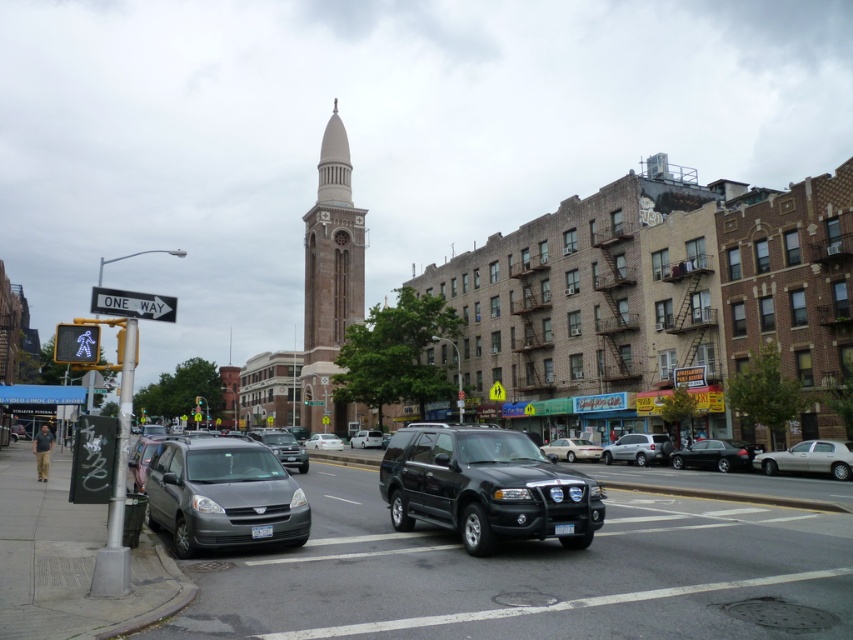
You are a delivery driver navigating through the intersection. Your GPS indicates you need to turn left at the next intersection, but there is a black matte suv at center blocking your path. Based on its position, can you estimate if there is enough space to maneuver around it?

The black matte suv at center is positioned at coordinates point (486,486). Without specific measurements of the vehicle or available space, it is difficult to determine if there is enough space to maneuver around it safely. Consider checking for alternative routes or waiting for the vehicle to move.